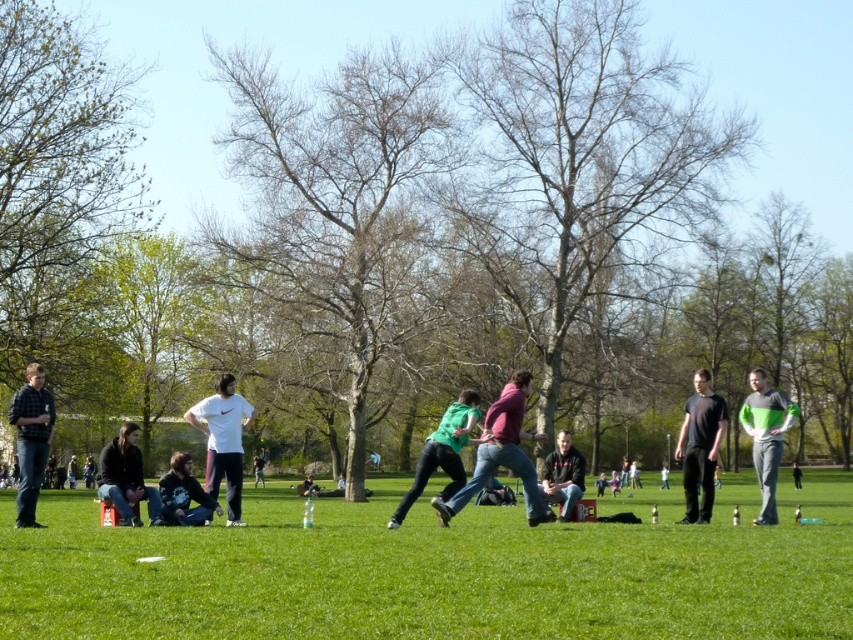
Who is lower down, black matte shirt at center or dark gray jacket at lower left?

black matte shirt at center

Between black matte shirt at center and dark gray jacket at lower left, which one has less height?

dark gray jacket at lower left is shorter.

Which is behind, point (724, 401) or point (122, 426)?

Point (724, 401)

This screenshot has height=640, width=853. Find the location of `black matte shirt at center`. black matte shirt at center is located at coordinates (700, 445).

Does gray-green sweater at center appear on the left side of dark blue jeans at lower center?

In fact, gray-green sweater at center is to the right of dark blue jeans at lower center.

Does point (750, 403) lie in front of point (206, 496)?

No.

I want to click on gray-green sweater at center, so click(x=766, y=436).

Between white matte shirt at center and gray-green sweater at center, which one has less height?

With less height is white matte shirt at center.

From the picture: Between white matte shirt at center and gray-green sweater at center, which one is positioned lower?

gray-green sweater at center is below.

Is point (219, 458) closer to camera compared to point (770, 448)?

Yes, it is in front of point (770, 448).

In order to click on white matte shirt at center in this screenshot , I will do `click(223, 440)`.